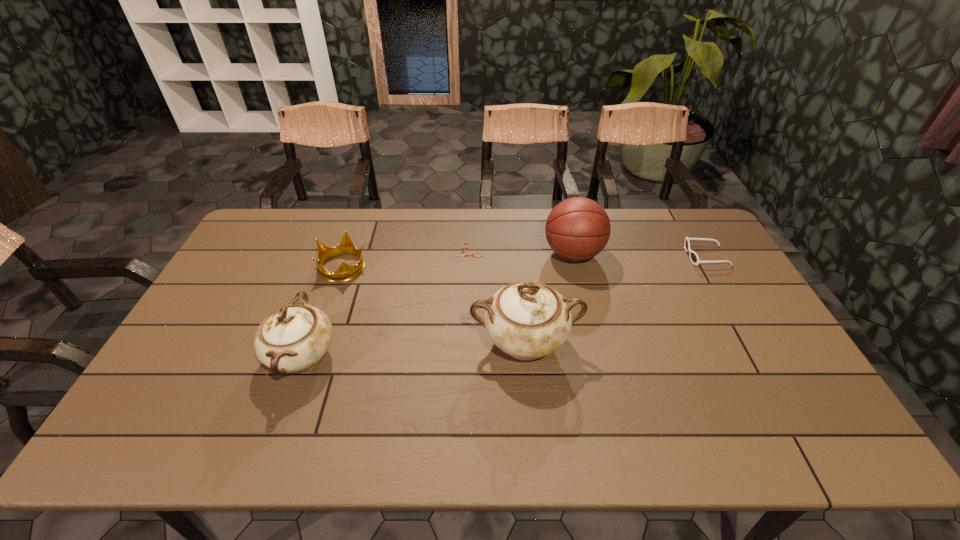
Please point a vacant point for placing a chinaware on the right. Please provide its 2D coordinates. Your answer should be formatted as a tuple, i.e. [(x, y)], where the tuple contains the x and y coordinates of a point satisfying the conditions above.

[(734, 328)]